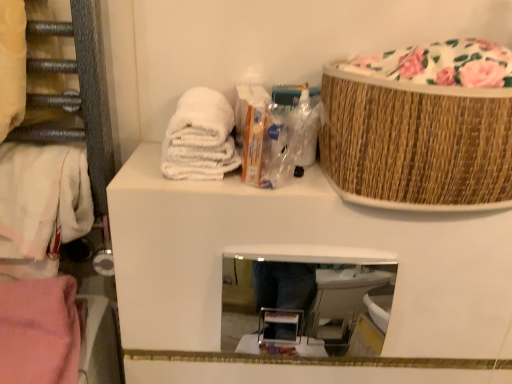
Where is `free point above floral fabric basket at upper right (from a real-world perspective)`? Image resolution: width=512 pixels, height=384 pixels. free point above floral fabric basket at upper right (from a real-world perspective) is located at coordinates pyautogui.click(x=441, y=38).